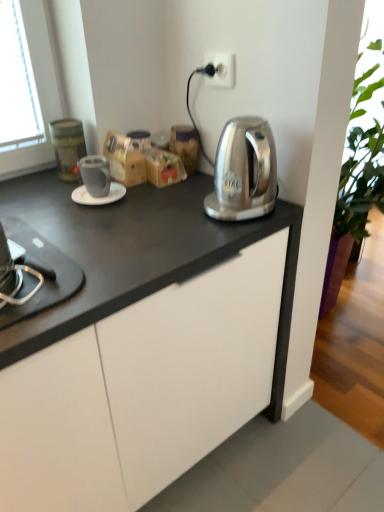
Image resolution: width=384 pixels, height=512 pixels. Identify the location of vacant space that's between black glass stovetop at lower left and white glossy saucer at center. (78, 231).